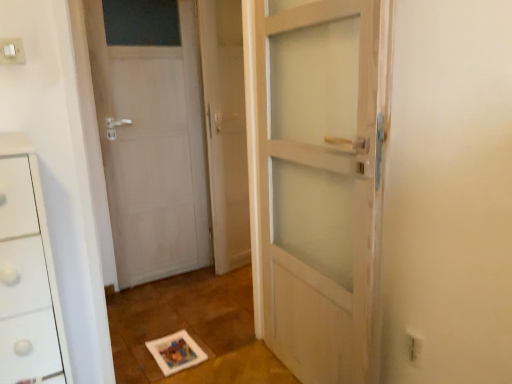
What is the approximate height of white matte door at left?

It is 1.60 meters.

Find the location of a particular element. Image resolution: width=512 pixels, height=384 pixels. white plastic electric outlet at upper left, the 1th electric outlet positioned from the left is located at coordinates (12, 51).

Where is `white matte door at left`? white matte door at left is located at coordinates (152, 147).

Is white matte door at left positioned far away from white plastic electric outlet at upper left, the second electric outlet viewed from the right?

Yes.

Between white matte door at left and white plastic electric outlet at upper left, the second electric outlet viewed from the right, which one has larger width?

white matte door at left.

Measure the distance between white matte door at left and white plastic electric outlet at upper left, the second electric outlet viewed from the right.

The distance of white matte door at left from white plastic electric outlet at upper left, the second electric outlet viewed from the right, is 1.40 meters.

Does white matte door at left turn towards white plastic electric outlet at upper left, placed as the second electric outlet when sorted from bottom to top?

No, white matte door at left is not facing towards white plastic electric outlet at upper left, placed as the second electric outlet when sorted from bottom to top.

Do you think clear glass screen door at center is within white matte door at left, or outside of it?

clear glass screen door at center is not inside white matte door at left, it's outside.

How different are the orientations of clear glass screen door at center and white matte door at left in degrees?

The facing directions of clear glass screen door at center and white matte door at left are 8.79 degrees apart.

The height and width of the screenshot is (384, 512). Find the location of `door in front of the clear glass screen door at center`. door in front of the clear glass screen door at center is located at coordinates (152, 147).

Does clear glass screen door at center turn towards white matte door at left?

No, clear glass screen door at center is not aimed at white matte door at left.

Is clear glass screen door at center to the left of white plastic electric outlet at upper left, the 1th electric outlet positioned from the left, from the viewer's perspective?

In fact, clear glass screen door at center is to the right of white plastic electric outlet at upper left, the 1th electric outlet positioned from the left.

Based on the photo, from the image's perspective, which one is positioned lower, clear glass screen door at center or white plastic electric outlet at upper left, acting as the first electric outlet starting from the top?

clear glass screen door at center, from the image's perspective.

Does point (224, 137) come farther from viewer compared to point (15, 58)?

Yes, point (224, 137) is behind point (15, 58).

From a real-world perspective, relative to white plastic electric outlet at upper left, placed as the second electric outlet when sorted from bottom to top, is clear glass screen door at center vertically above or below?

clear glass screen door at center is below white plastic electric outlet at upper left, placed as the second electric outlet when sorted from bottom to top.

Looking at this image, from the image's perspective, is white plastic electric outlet at lower right, which ranks as the first electric outlet in bottom-to-top order, located beneath white matte door at left?

Yes, from the image's perspective, white plastic electric outlet at lower right, which ranks as the first electric outlet in bottom-to-top order, is below white matte door at left.

Is white plastic electric outlet at lower right, which ranks as the first electric outlet in bottom-to-top order, next to white matte door at left?

No, white plastic electric outlet at lower right, which ranks as the first electric outlet in bottom-to-top order, is not touching white matte door at left.

Is white plastic electric outlet at lower right, the 2th electric outlet when ordered from top to bottom, positioned with its back to white matte door at left?

white plastic electric outlet at lower right, the 2th electric outlet when ordered from top to bottom, is not turned away from white matte door at left.

The height and width of the screenshot is (384, 512). Find the location of `door behind the white plastic electric outlet at lower right, arranged as the second electric outlet when viewed from the left`. door behind the white plastic electric outlet at lower right, arranged as the second electric outlet when viewed from the left is located at coordinates (152, 147).

Which of these two, white matte door at left or clear glass screen door at center, is bigger?

white matte door at left is bigger.

Based on their positions, is white matte door at left located to the left or right of clear glass screen door at center?

From the image, it's evident that white matte door at left is to the left of clear glass screen door at center.

How distant is white matte door at left from clear glass screen door at center?

white matte door at left and clear glass screen door at center are 11.77 inches apart.

Is white matte door at left touching clear glass screen door at center?

white matte door at left is not next to clear glass screen door at center, and they're not touching.

Is clear glass screen door at center far away from white plastic electric outlet at lower right, which is the first electric outlet from right to left?

Yes, clear glass screen door at center and white plastic electric outlet at lower right, which is the first electric outlet from right to left, are quite far apart.

Is clear glass screen door at center thinner than white plastic electric outlet at lower right, arranged as the second electric outlet when viewed from the left?

Incorrect, the width of clear glass screen door at center is not less than that of white plastic electric outlet at lower right, arranged as the second electric outlet when viewed from the left.

From a real-world perspective, is clear glass screen door at center under white plastic electric outlet at lower right, which ranks as the first electric outlet in bottom-to-top order?

No.

Does clear glass screen door at center appear on the right side of white plastic electric outlet at lower right, which is the first electric outlet from right to left?

Incorrect, clear glass screen door at center is not on the right side of white plastic electric outlet at lower right, which is the first electric outlet from right to left.

From the image's perspective, is white plastic electric outlet at upper left, placed as the second electric outlet when sorted from bottom to top, located above or below white matte door at left?

Clearly, from the image's perspective, white plastic electric outlet at upper left, placed as the second electric outlet when sorted from bottom to top, is above white matte door at left.

Is white matte door at left completely or partially inside white plastic electric outlet at upper left, placed as the second electric outlet when sorted from bottom to top?

No, white matte door at left is located outside of white plastic electric outlet at upper left, placed as the second electric outlet when sorted from bottom to top.

Considering the relative positions of white plastic electric outlet at upper left, the second electric outlet viewed from the right, and white matte door at left in the image provided, is white plastic electric outlet at upper left, the second electric outlet viewed from the right, to the left of white matte door at left from the viewer's perspective?

Yes.

Considering the positions of point (21, 50) and point (198, 209), is point (21, 50) closer or farther from the camera than point (198, 209)?

Clearly, point (21, 50) is closer to the camera than point (198, 209).

Where is `the 2nd electric outlet in front of the white matte door at left`? This screenshot has height=384, width=512. the 2nd electric outlet in front of the white matte door at left is located at coordinates (12, 51).

Locate an element on the screen. This screenshot has width=512, height=384. door below the clear glass screen door at center (from the image's perspective) is located at coordinates (152, 147).

Which object lies further to the anchor point white plastic electric outlet at lower right, arranged as the second electric outlet when viewed from the left, white plastic electric outlet at upper left, the 1th electric outlet positioned from the left, or white matte door at left?

white matte door at left is further to white plastic electric outlet at lower right, arranged as the second electric outlet when viewed from the left.

Based on their spatial positions, is clear glass screen door at center or white plastic electric outlet at upper left, the second electric outlet viewed from the right, further from white plastic electric outlet at lower right, which is the first electric outlet from right to left?

The object further to white plastic electric outlet at lower right, which is the first electric outlet from right to left, is clear glass screen door at center.

Based on their spatial positions, is white matte door at left or clear glass screen door at center further from white plastic electric outlet at lower right, arranged as the second electric outlet when viewed from the left?

white matte door at left is positioned further to the anchor white plastic electric outlet at lower right, arranged as the second electric outlet when viewed from the left.

Based on the photo, which object lies further to the anchor point white matte door at left, clear glass screen door at center or white plastic electric outlet at upper left, the second electric outlet viewed from the right?

Among the two, white plastic electric outlet at upper left, the second electric outlet viewed from the right, is located further to white matte door at left.

Estimate the real-world distances between objects in this image. Which object is closer to white plastic electric outlet at upper left, acting as the first electric outlet starting from the top, white matte door at left or clear glass screen door at center?

white matte door at left lies closer to white plastic electric outlet at upper left, acting as the first electric outlet starting from the top, than the other object.

Estimate the real-world distances between objects in this image. Which object is further from white plastic electric outlet at upper left, acting as the first electric outlet starting from the top, white plastic electric outlet at lower right, the 2th electric outlet when ordered from top to bottom, or white matte door at left?

The object further to white plastic electric outlet at upper left, acting as the first electric outlet starting from the top, is white plastic electric outlet at lower right, the 2th electric outlet when ordered from top to bottom.

From the image, which object appears to be nearer to white plastic electric outlet at upper left, placed as the second electric outlet when sorted from bottom to top, clear glass screen door at center or white plastic electric outlet at lower right, which ranks as the first electric outlet in bottom-to-top order?

white plastic electric outlet at lower right, which ranks as the first electric outlet in bottom-to-top order, is closer to white plastic electric outlet at upper left, placed as the second electric outlet when sorted from bottom to top.

Estimate the real-world distances between objects in this image. Which object is further from white plastic electric outlet at upper left, placed as the second electric outlet when sorted from bottom to top, white plastic electric outlet at lower right, arranged as the second electric outlet when viewed from the left, or clear glass screen door at center?

Based on the image, clear glass screen door at center appears to be further to white plastic electric outlet at upper left, placed as the second electric outlet when sorted from bottom to top.

Find the location of a particular element. This screenshot has width=512, height=384. door located between white plastic electric outlet at lower right, the 2th electric outlet when ordered from top to bottom, and clear glass screen door at center in the depth direction is located at coordinates (152, 147).

What are the coordinates of `door between white plastic electric outlet at upper left, the 1th electric outlet positioned from the left, and white plastic electric outlet at lower right, the 2th electric outlet when ordered from top to bottom` in the screenshot? It's located at (152, 147).

Where is `door positioned between white plastic electric outlet at upper left, acting as the first electric outlet starting from the top, and clear glass screen door at center from near to far`? Image resolution: width=512 pixels, height=384 pixels. door positioned between white plastic electric outlet at upper left, acting as the first electric outlet starting from the top, and clear glass screen door at center from near to far is located at coordinates (152, 147).

At what (x,y) coordinates should I click in order to perform the action: click on screen door located between white plastic electric outlet at upper left, acting as the first electric outlet starting from the top, and white plastic electric outlet at lower right, which is the first electric outlet from right to left, in the left-right direction. Please return your answer as a coordinate pair (x, y). Image resolution: width=512 pixels, height=384 pixels. Looking at the image, I should click on tap(225, 130).